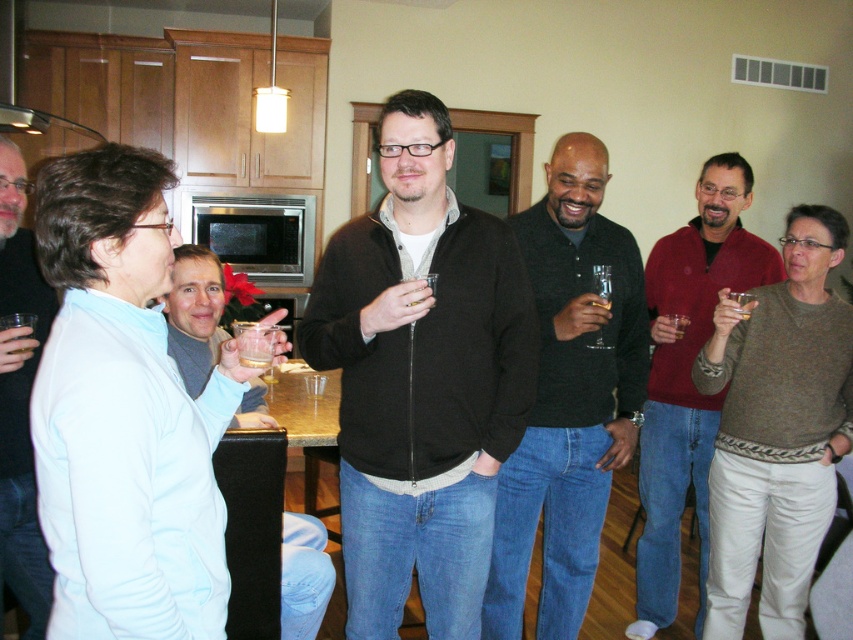
You are at a social event and want to grab your jacket. You see both the dark gray sweater at center and the matte black jacket at center. Which one is positioned to the right side?

The dark gray sweater at center is positioned to the right of the matte black jacket at center.

You are at a party and want to grab the clear glass wine glass at center without disturbing the dark gray sweater at center. How can you do that?

The dark gray sweater at center is positioned under the clear glass wine glass at center, so you can carefully lift the wine glass by its stem, ensuring not to touch the sweater below.

You are a photographer planning to take a group photo of the dark gray sweater at center and the matte black jacket at center. The camera you have can only focus on objects within a 3.5 feet distance range. Will both subjects be in focus if they are positioned 4.21 feet apart?

The dark gray sweater at center and the matte black jacket at center are 4.21 feet apart from each other. Since the camera can only focus within a 3.5 feet range, the distance between them exceeds this limit. Therefore, both subjects will not be in focus simultaneously.